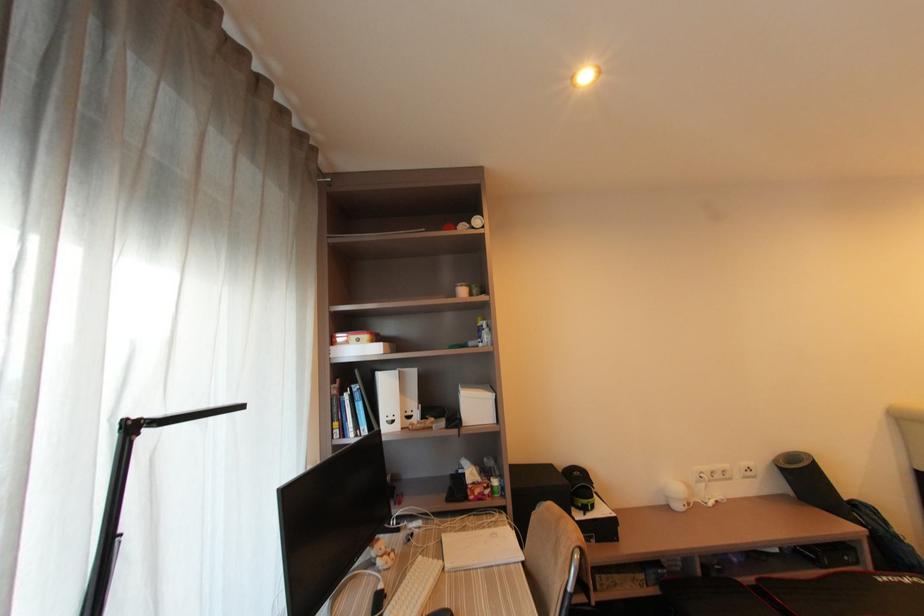
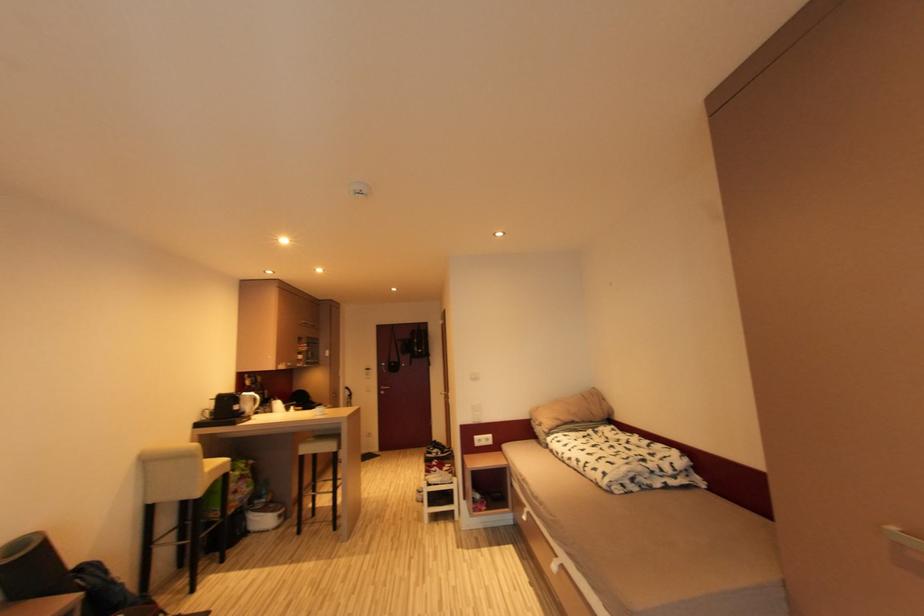
Question: Based on the continuous images, in which direction is the camera rotating? Reply with the corresponding letter.

Choices:
 (A) Left
 (B) Right
 (C) Up
 (D) Down

Answer: (B)